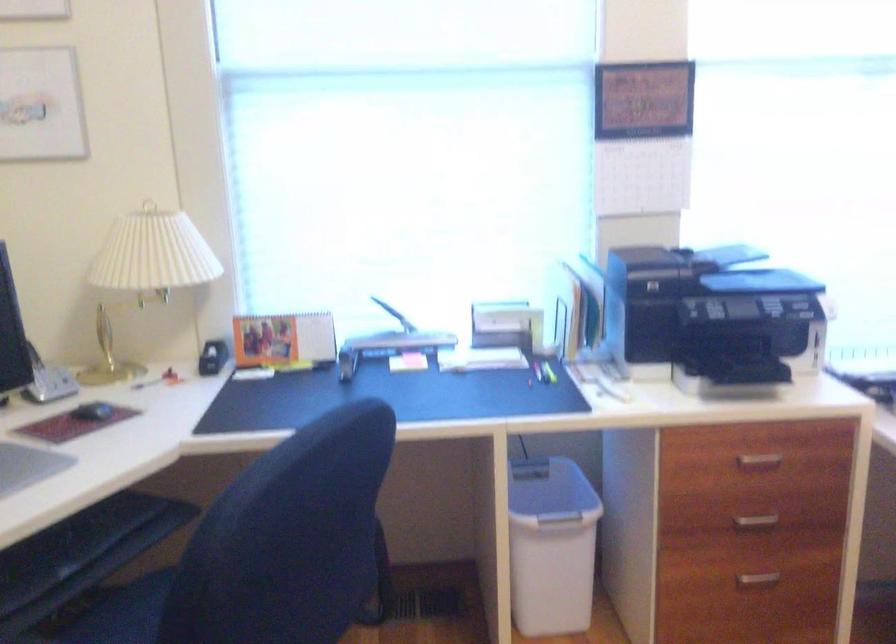
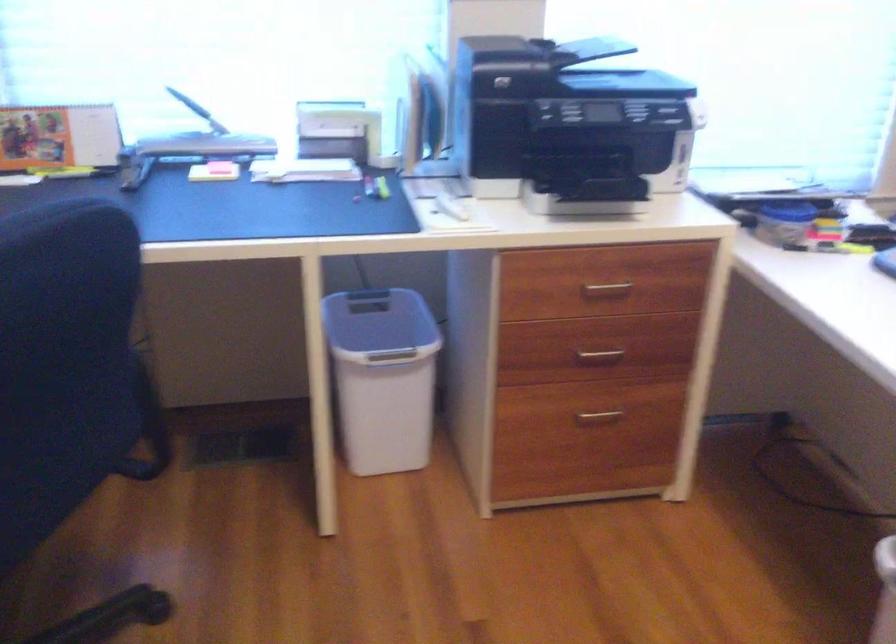
Question: The images are taken continuously from a first-person perspective. In which direction is your viewpoint rotating?

Choices:
 (A) Left
 (B) Right
 (C) Up
 (D) Down

Answer: (D)